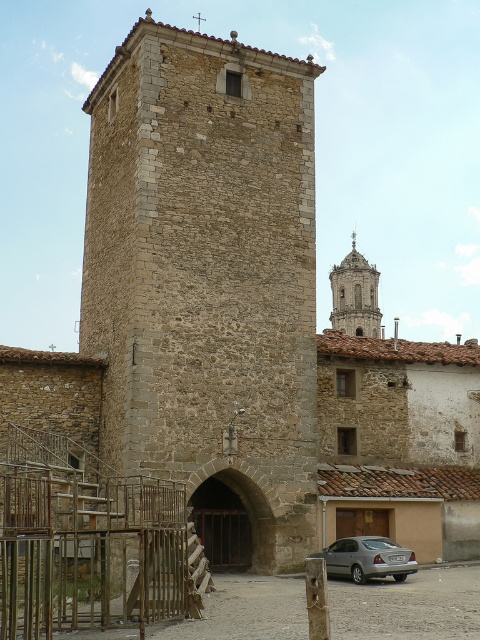
You are standing at the base of the historic stone tower and want to place a small decorative statue between the two points labeled point [180,64] and point [384,524]. According to the scene description, which point should the statue be closer to in order to be positioned in front of the tower?

The statue should be placed closer to point [180,64] because it is in front of point [384,524] according to the description.

Consider the image. You are standing in front of the brown stone tower at center and the smooth stone bell tower at upper center. Which one is taller?

The smooth stone bell tower at upper center is taller than the brown stone tower at center.

Consider the image. You are a delivery driver approaching the smooth stone bell tower at upper center and the satin silver sedan at lower right. Which object will you encounter first as you drive towards the tower?

You will encounter the smooth stone bell tower at upper center first because it is closer to you than the satin silver sedan at lower right, which is further away.